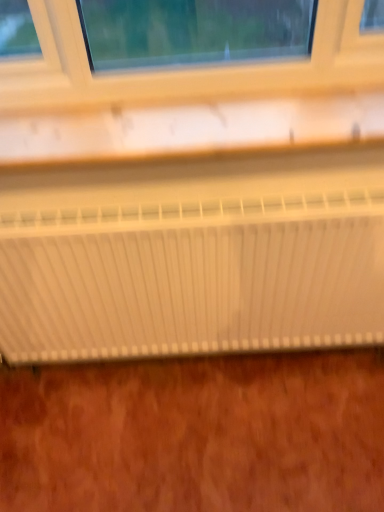
What is the approximate height of white ribbed radiator at lower center?

The height of white ribbed radiator at lower center is 24.17 inches.

Locate an element on the screen. white ribbed radiator at lower center is located at coordinates (191, 274).

Image resolution: width=384 pixels, height=512 pixels. Describe the element at coordinates (191, 274) in the screenshot. I see `white ribbed radiator at lower center` at that location.

At what (x,y) coordinates should I click in order to perform the action: click on white ribbed radiator at lower center. Please return your answer as a coordinate pair (x, y). Looking at the image, I should click on (191, 274).